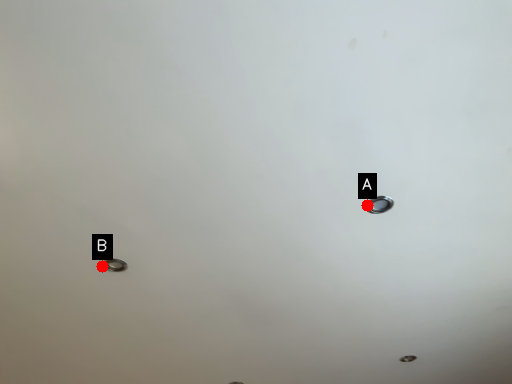
Question: Two points are circled on the image, labeled by A and B beside each circle. Among these points, which one is nearest to the camera?

Choices:
 (A) A is closer
 (B) B is closer

Answer: (A)